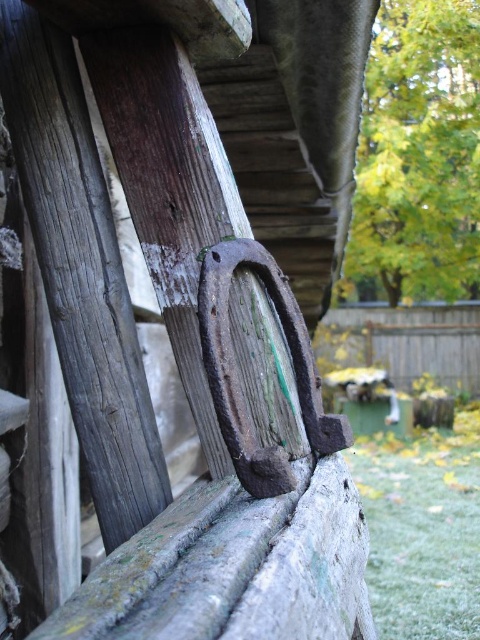
Is green leafy tree at upper right taller than green grass at lower right?

Yes.

Does green leafy tree at upper right appear on the left side of green grass at lower right?

Incorrect, green leafy tree at upper right is not on the left side of green grass at lower right.

Which is behind, point (346, 269) or point (377, 582)?

The point (346, 269) is behind.

Where is `green leafy tree at upper right`? green leafy tree at upper right is located at coordinates (420, 154).